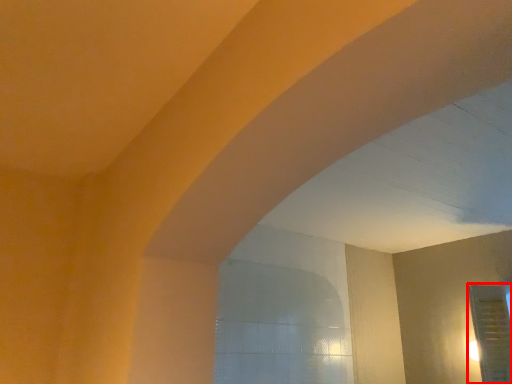
Question: Observing the image, what is the correct spatial positioning of glass door (annotated by the red box) in reference to window?

Choices:
 (A) left
 (B) right

Answer: (B)